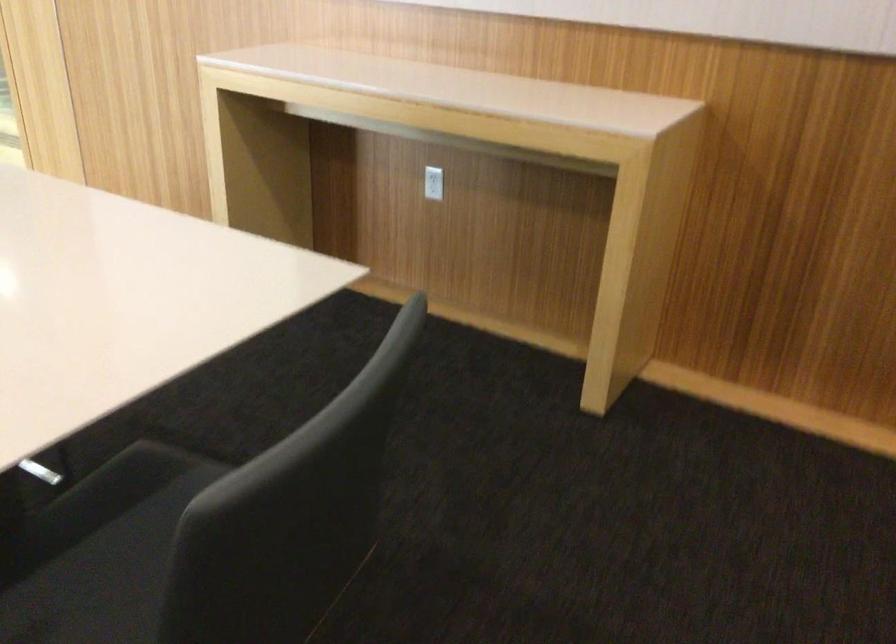
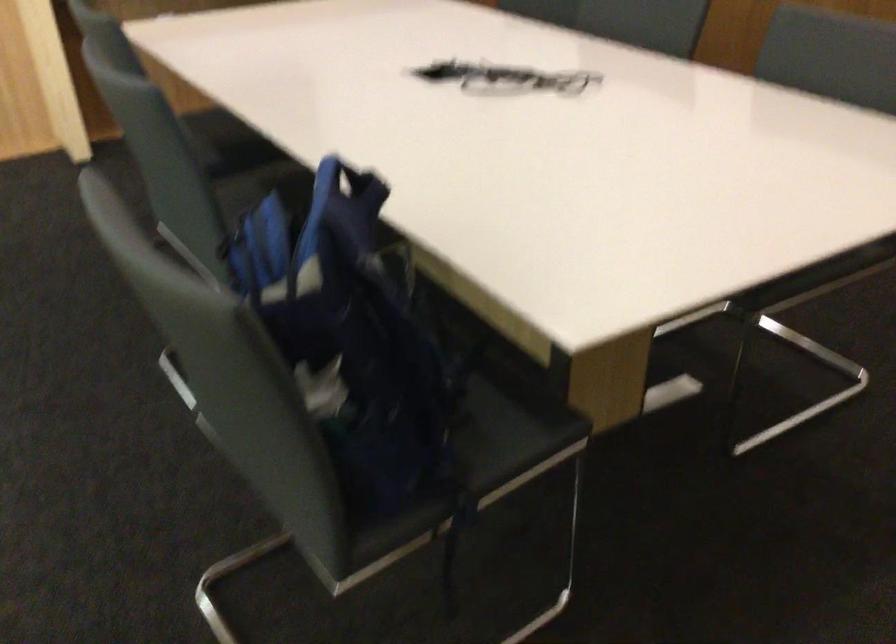
Question: I am providing you with two images of the same scene from different viewpoints. Which of the following objects are not visible in image2?

Choices:
 (A) blue backpack handle
 (B) dark chair sitting surface
 (C) chair sitting surface
 (D) red perfume bottle

Answer: (B)